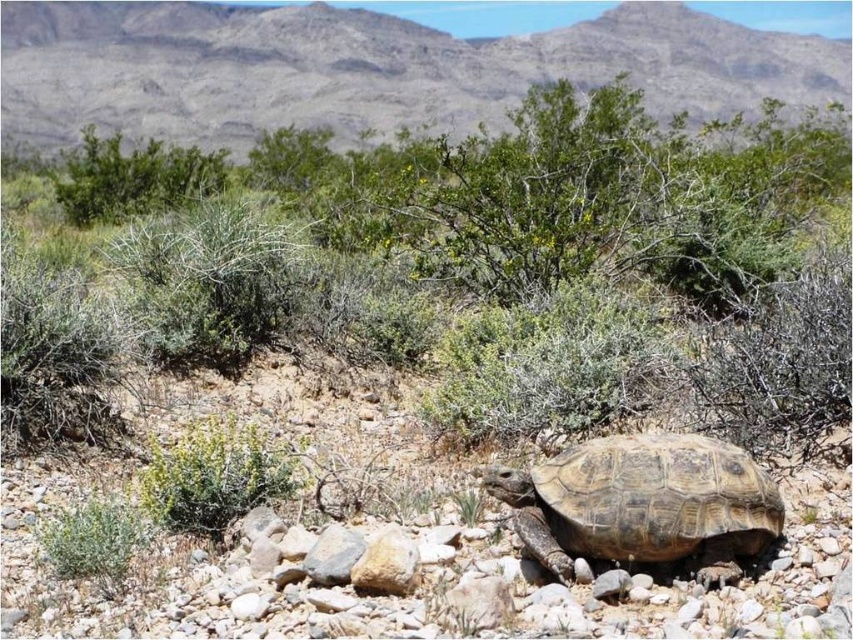
Which of these two, green shrubs at center or brown textured tortoise at center, stands taller?

Standing taller between the two is green shrubs at center.

Between point (445, 216) and point (550, 554), which one is positioned behind?

The point (445, 216) is more distant.

You are a GUI agent. You are given a task and a screenshot of the screen. Output one action in this format:
    pyautogui.click(x=<x>, y=<y>)
    Task: Click on the green shrubs at center
    This screenshot has height=640, width=853.
    Given the screenshot: What is the action you would take?
    pyautogui.click(x=521, y=193)

The width and height of the screenshot is (853, 640). Find the location of `green shrubs at center`. green shrubs at center is located at coordinates (521, 193).

Who is more distant from viewer, (393, 248) or (287, 474)?

The point (393, 248) is behind.

Which is more to the left, green shrubs at center or green leafy bush at center?

From the viewer's perspective, green leafy bush at center appears more on the left side.

You are a GUI agent. You are given a task and a screenshot of the screen. Output one action in this format:
    pyautogui.click(x=<x>, y=<y>)
    Task: Click on the green shrubs at center
    
    Given the screenshot: What is the action you would take?
    tap(521, 193)

Does brown textured tortoise at center appear on the right side of green leafy bush at center?

Yes, brown textured tortoise at center is to the right of green leafy bush at center.

Measure the distance between point [538,516] and camera.

Point [538,516] is 4.36 meters away from camera.

Between point (724, 540) and point (292, 464), which one is positioned behind?

The point (292, 464) is behind.

Locate an element on the screen. This screenshot has width=853, height=640. brown textured tortoise at center is located at coordinates (642, 502).